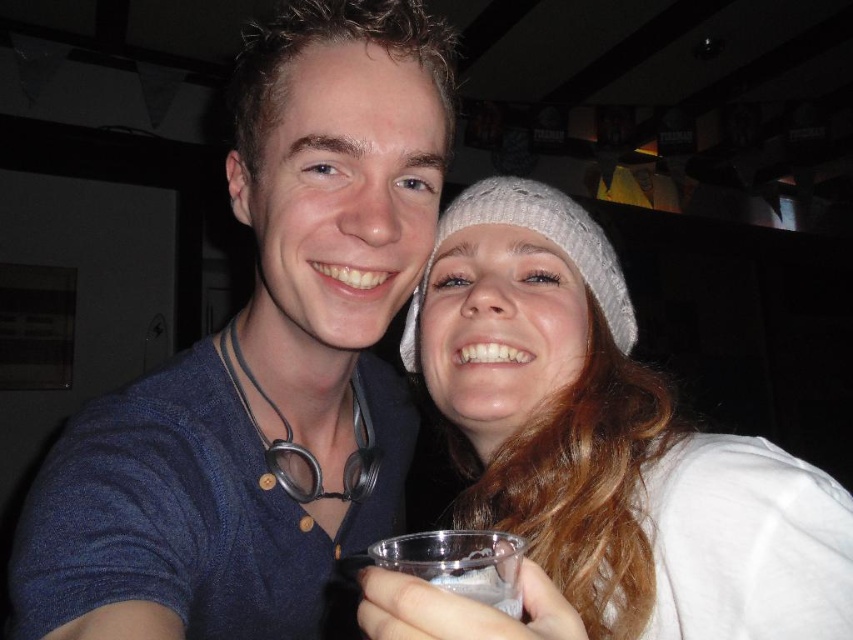
Based on the photo, you are organizing a clothing donation drive and need to determine if the blue fabric shirt at center can fit into a storage box that is the same size as the clear plastic cup at lower center. Based on their widths, will the shirt fit?

The blue fabric shirt at center is wider than the clear plastic cup at lower center, so it will not fit into a storage box of the same size as the cup.

You are standing in front of a photo of two people. The young man on the left is wearing a dark blue tshirt and has glasses around his neck. The young woman on the right has long wavy hair and holds a cup. There is a specific point at center marked as point [263,360]. Which object from the scene is exactly at that coordinate?

The blue fabric shirt at center is located at point [263,360].

You are a photographer trying to focus on the blue fabric shirt at center and the white knitted hat at upper right. Which object should you adjust your camera focus to first if you want to capture both clearly in the same frame?

The blue fabric shirt at center should be focused on first because it is positioned under the white knitted hat at upper right, meaning it is closer to the camera. Adjusting focus starting from the closer object ensures both can be in focus when using depth of field appropriately.